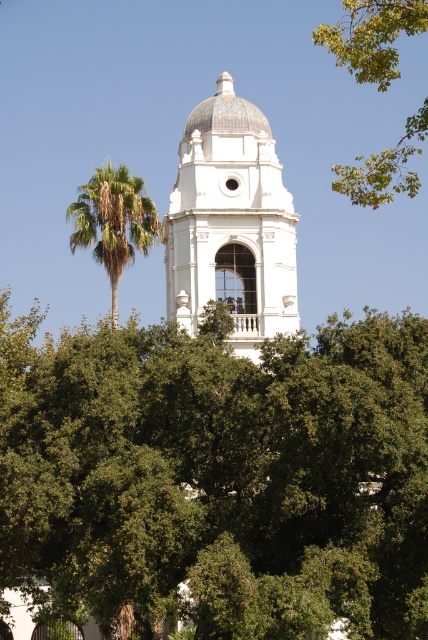
You are standing at the base of the bell tower and want to walk towards the point labeled point (x=270, y=161). However, there is an obstacle at point (x=86, y=221). Will you encounter this obstacle before reaching your destination?

Yes, you will encounter the obstacle at point (x=86, y=221) before reaching point (x=270, y=161) because point (x=270, y=161) is behind point (x=86, y=221).

You are standing at the base of the bell tower and notice two green leafy trees in the scene. Which tree, the green leafy tree at center or the green leafy tree at upper right, is closer to the bell tower?

The green leafy tree at center is closer to the bell tower because it is positioned under the green leafy tree at upper right, indicating it is in front spatially.